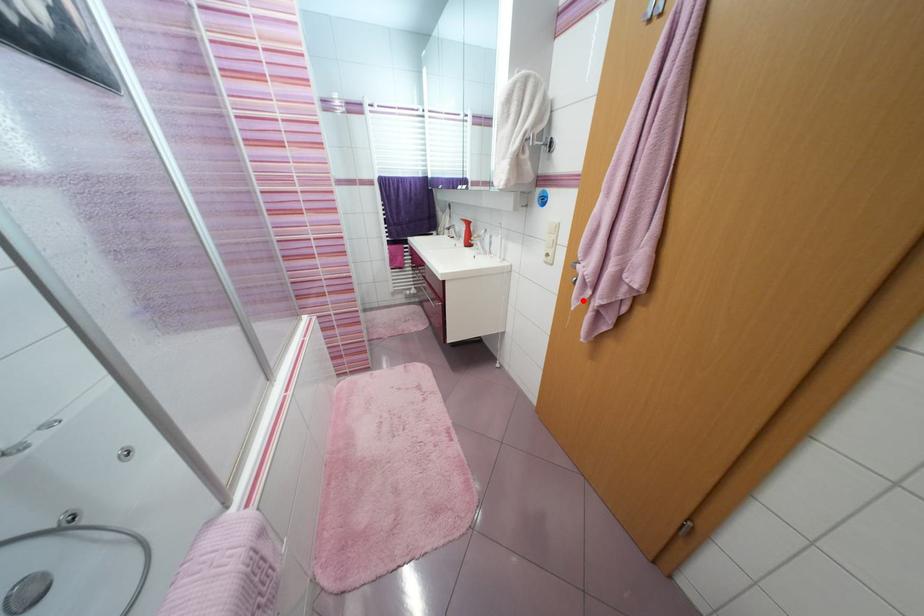
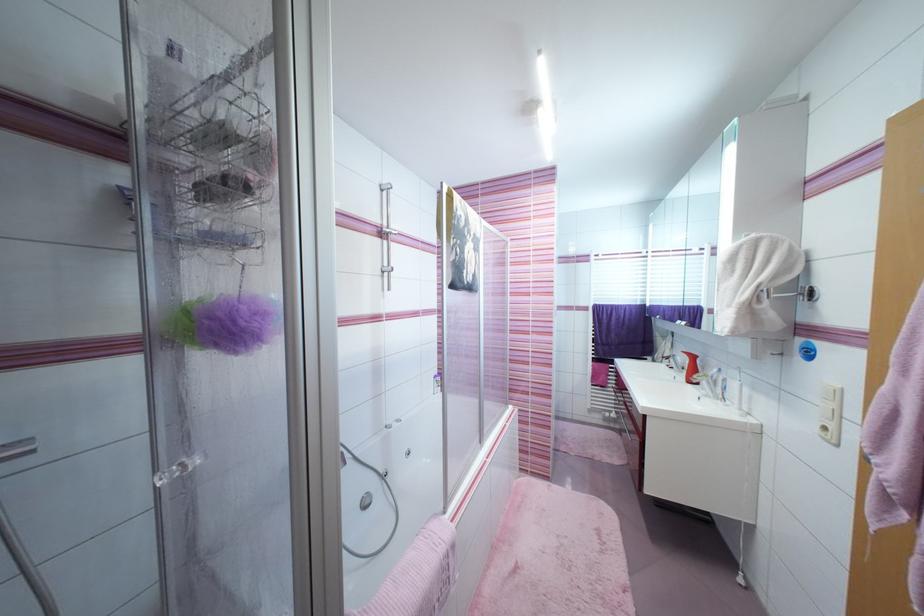
Find the pixel in the second image that matches the highlighted location in the first image.

(883, 517)